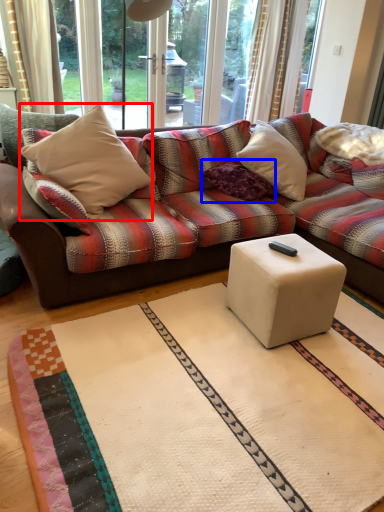
Question: Among these objects, which one is farthest to the camera, throw pillow (highlighted by a red box) or pillow (highlighted by a blue box)?

Choices:
 (A) throw pillow
 (B) pillow

Answer: (B)